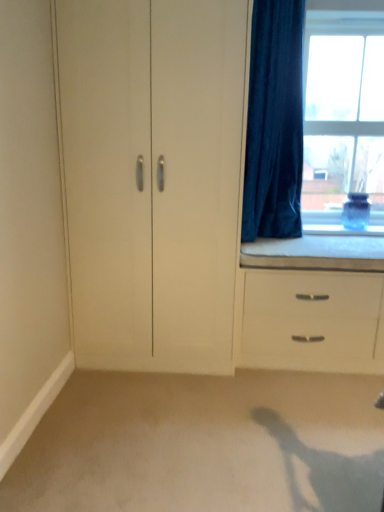
Question: Does white matte cabinet at center appear on the right side of velvet dark blue curtain at right?

Choices:
 (A) no
 (B) yes

Answer: (A)

Question: From the image's perspective, is white matte cabinet at center beneath velvet dark blue curtain at right?

Choices:
 (A) yes
 (B) no

Answer: (A)

Question: Considering the relative sizes of white matte cabinet at center and velvet dark blue curtain at right in the image provided, is white matte cabinet at center shorter than velvet dark blue curtain at right?

Choices:
 (A) no
 (B) yes

Answer: (A)

Question: From a real-world perspective, is white matte cabinet at center located higher than velvet dark blue curtain at right?

Choices:
 (A) yes
 (B) no

Answer: (B)

Question: Is the position of white matte cabinet at center more distant than that of velvet dark blue curtain at right?

Choices:
 (A) no
 (B) yes

Answer: (A)

Question: Could you tell me if white matte cabinet at center is facing velvet dark blue curtain at right?

Choices:
 (A) yes
 (B) no

Answer: (B)

Question: Considering the relative sizes of white foam cushion at window and clear glass window at upper right in the image provided, is white foam cushion at window taller than clear glass window at upper right?

Choices:
 (A) no
 (B) yes

Answer: (A)

Question: Does white foam cushion at window appear on the right side of clear glass window at upper right?

Choices:
 (A) no
 (B) yes

Answer: (A)

Question: Considering the relative sizes of white foam cushion at window and clear glass window at upper right in the image provided, is white foam cushion at window wider than clear glass window at upper right?

Choices:
 (A) yes
 (B) no

Answer: (A)

Question: From a real-world perspective, does white foam cushion at window sit lower than clear glass window at upper right?

Choices:
 (A) yes
 (B) no

Answer: (A)

Question: Is the position of white foam cushion at window less distant than that of clear glass window at upper right?

Choices:
 (A) no
 (B) yes

Answer: (B)

Question: From the image's perspective, would you say white foam cushion at window is shown under clear glass window at upper right?

Choices:
 (A) yes
 (B) no

Answer: (A)

Question: Is white matte chest of drawers at lower right smaller than white matte cabinet at center?

Choices:
 (A) no
 (B) yes

Answer: (A)